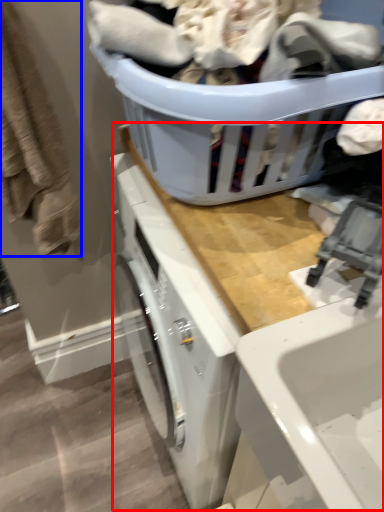
Question: Which of the following is the farthest to the observer, counter top (highlighted by a red box) or clothing (highlighted by a blue box)?

Choices:
 (A) counter top
 (B) clothing

Answer: (B)